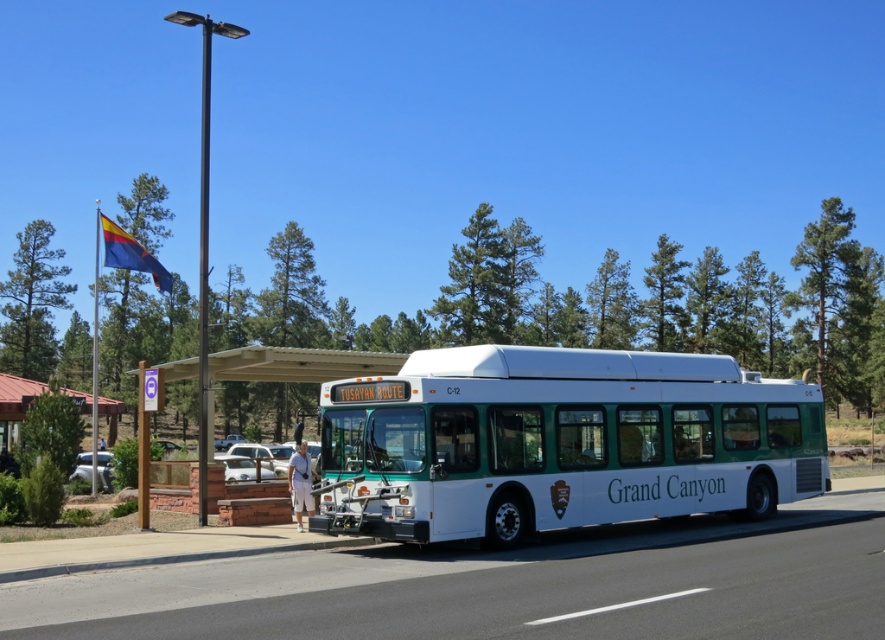
Does wooden bus stop at center have a larger size compared to metallic silver car at center?

Yes.

Does wooden bus stop at center have a smaller size compared to metallic silver car at center?

Incorrect, wooden bus stop at center is not smaller in size than metallic silver car at center.

This screenshot has width=885, height=640. I want to click on wooden bus stop at center, so click(298, 364).

You are a GUI agent. You are given a task and a screenshot of the screen. Output one action in this format:
    pyautogui.click(x=<x>, y=<y>)
    Task: Click on the white/green plastic bus at center
    The image size is (885, 640).
    Given the screenshot: What is the action you would take?
    pyautogui.click(x=560, y=442)

Between white/green plastic bus at center and blue fabric flag at upper left, which one is positioned lower?

Positioned lower is white/green plastic bus at center.

Between point (652, 444) and point (99, 212), which one is positioned behind?

The point (99, 212) is behind.

You are a GUI agent. You are given a task and a screenshot of the screen. Output one action in this format:
    pyautogui.click(x=<x>, y=<y>)
    Task: Click on the white/green plastic bus at center
    This screenshot has width=885, height=640.
    Given the screenshot: What is the action you would take?
    pyautogui.click(x=560, y=442)

Is the position of metallic red bus stop at left less distant than that of blue fabric flag at upper left?

No, it is not.

Does metallic red bus stop at left appear under blue fabric flag at upper left?

Yes, metallic red bus stop at left is below blue fabric flag at upper left.

Find the location of `metallic red bus stop at left`. metallic red bus stop at left is located at coordinates (14, 406).